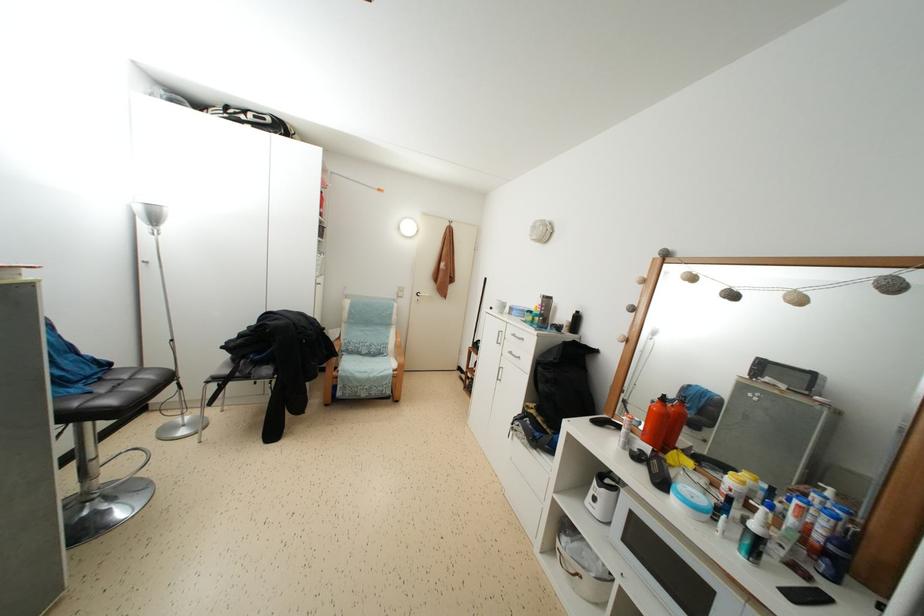
Find where to push the blue pump bottle. Please return your answer as a coordinate pair (x, y).

(755, 536)